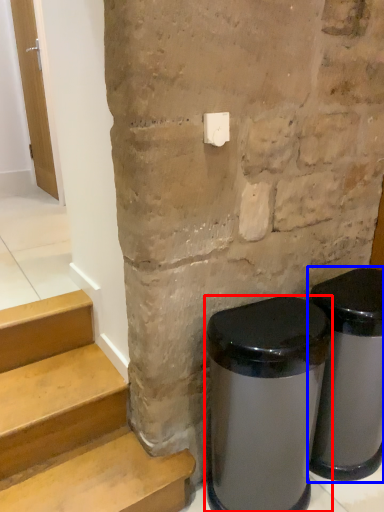
Question: Which object is further to the camera taking this photo, waste container (highlighted by a red box) or waste container (highlighted by a blue box)?

Choices:
 (A) waste container
 (B) waste container

Answer: (B)